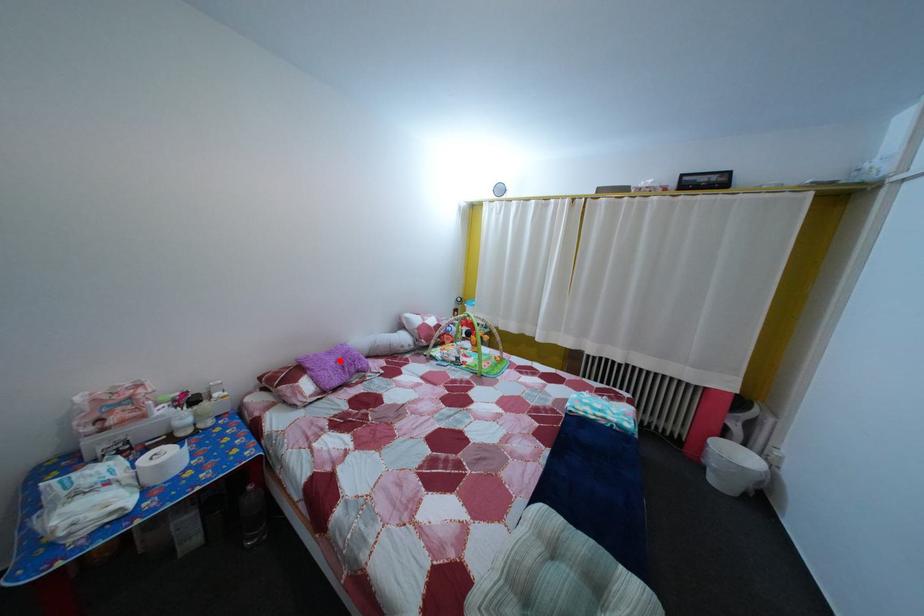
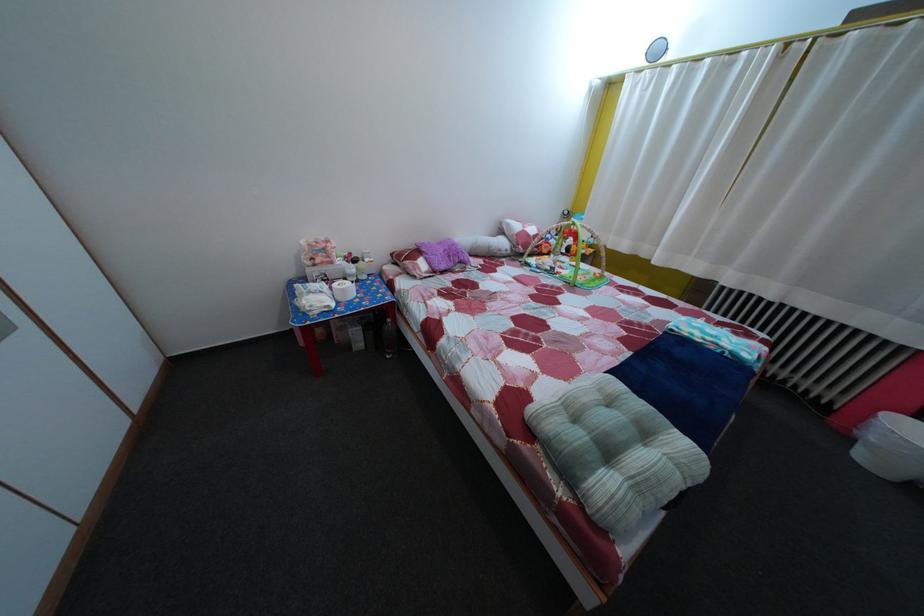
Locate, in the second image, the point that corresponds to the highlighted location in the first image.

(450, 252)